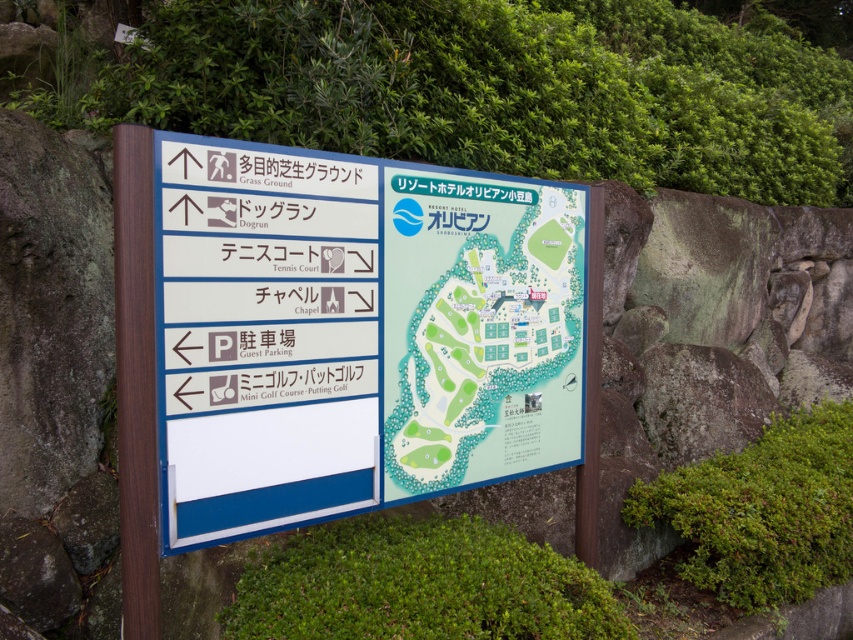
Who is more distant from viewer, (299, 428) or (418, 492)?

The point (418, 492) is more distant.

Is wooden signboard at center to the right of green paper map at center from the viewer's perspective?

In fact, wooden signboard at center is to the left of green paper map at center.

Is point (387, 252) in front of point (392, 298)?

Yes.

The height and width of the screenshot is (640, 853). Identify the location of wooden signboard at center. (357, 332).